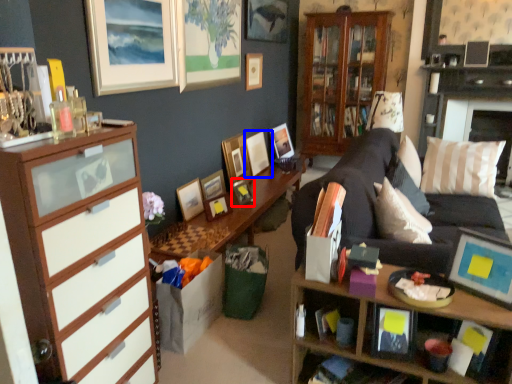
Question: Which of the following is the closest to the observer, picture frame (highlighted by a red box) or picture frame (highlighted by a blue box)?

Choices:
 (A) picture frame
 (B) picture frame

Answer: (A)